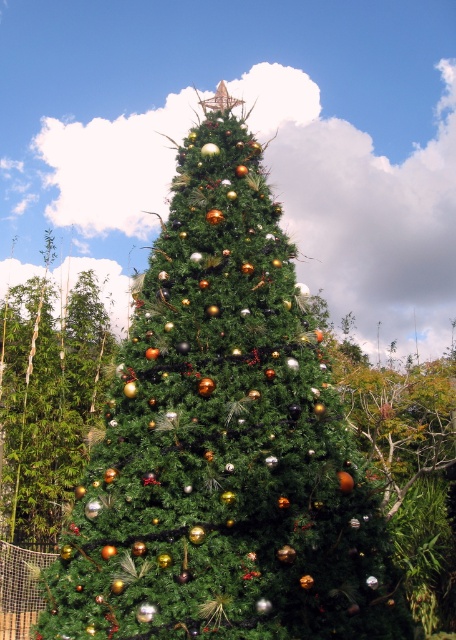
Does green matte christmas tree at center have a larger size compared to shiny gold ornaments at left?

Actually, green matte christmas tree at center might be smaller than shiny gold ornaments at left.

Is green matte christmas tree at center positioned before shiny gold ornaments at left?

That is True.

Between point (274, 490) and point (15, 388), which one is positioned behind?

Point (15, 388)

Image resolution: width=456 pixels, height=640 pixels. Identify the location of green matte christmas tree at center. 222,442.